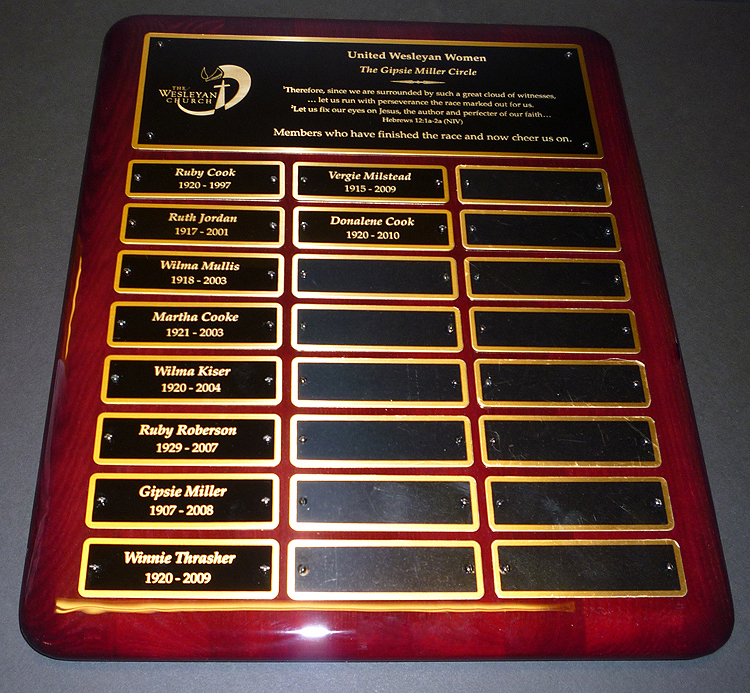
At what (x,y) coordinates should I click in order to perform the action: click on light reflections. Please return your answer as a coordinate pair (x, y). Looking at the image, I should click on (70, 314), (314, 631), (152, 606), (416, 606).